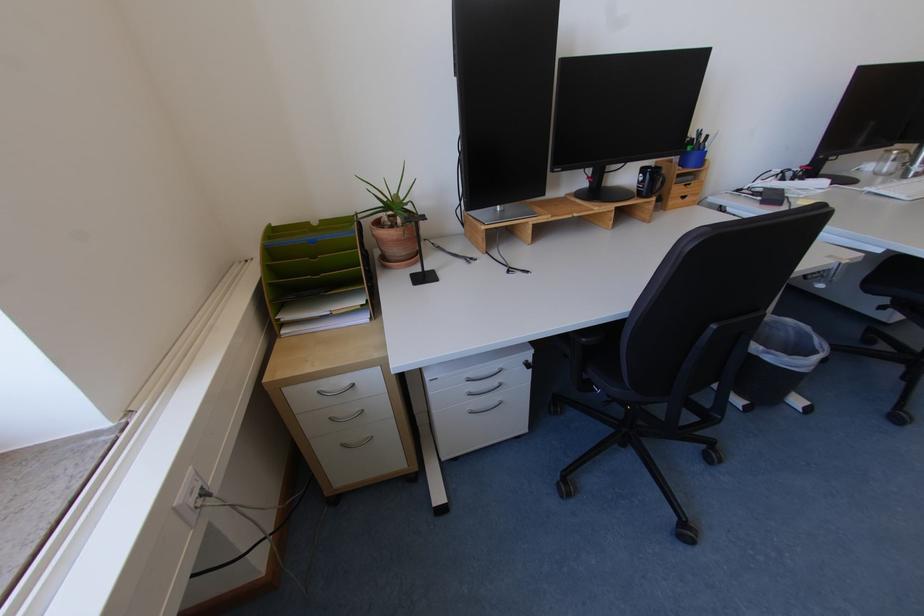
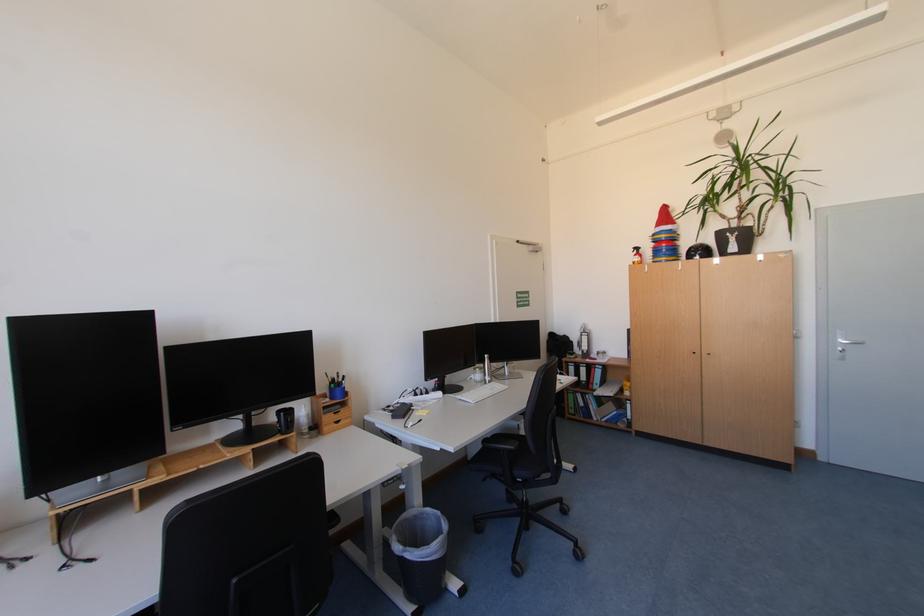
Find the pixel in the second image that matches (764,358) in the first image.

(409, 557)